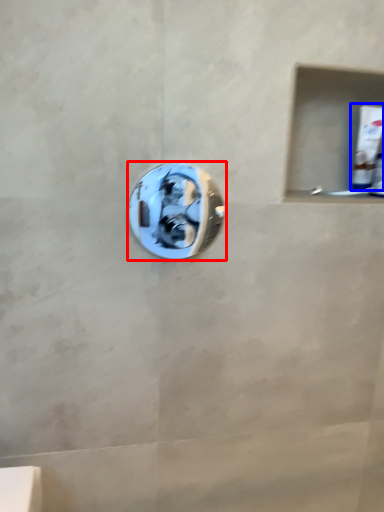
Question: Which object appears farthest to the camera in this image, door handle (highlighted by a red box) or toothpaste (highlighted by a blue box)?

Choices:
 (A) door handle
 (B) toothpaste

Answer: (B)